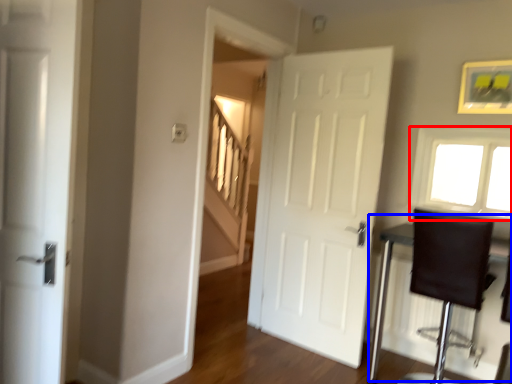
Question: Which of the following is the farthest to the observer, window (highlighted by a red box) or table (highlighted by a blue box)?

Choices:
 (A) window
 (B) table

Answer: (A)